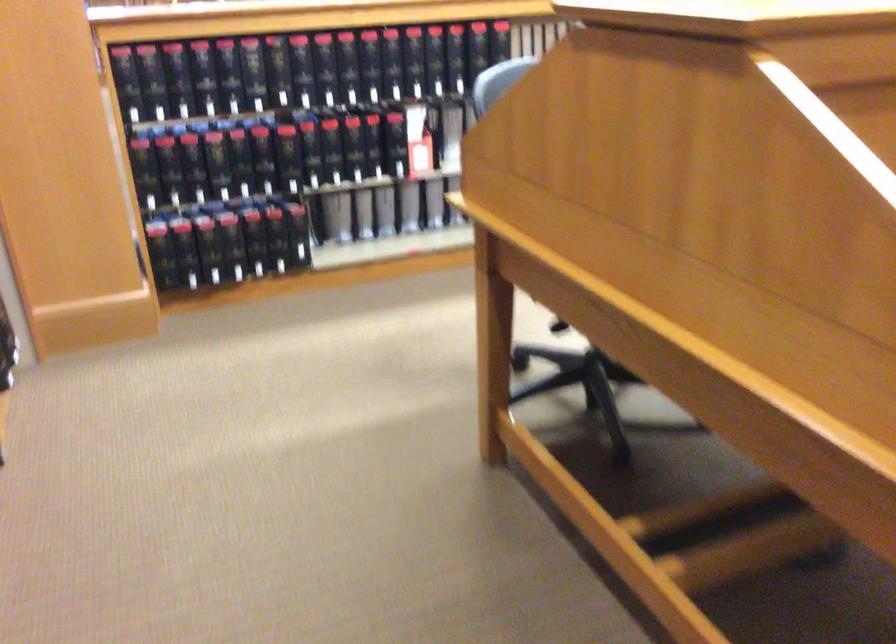
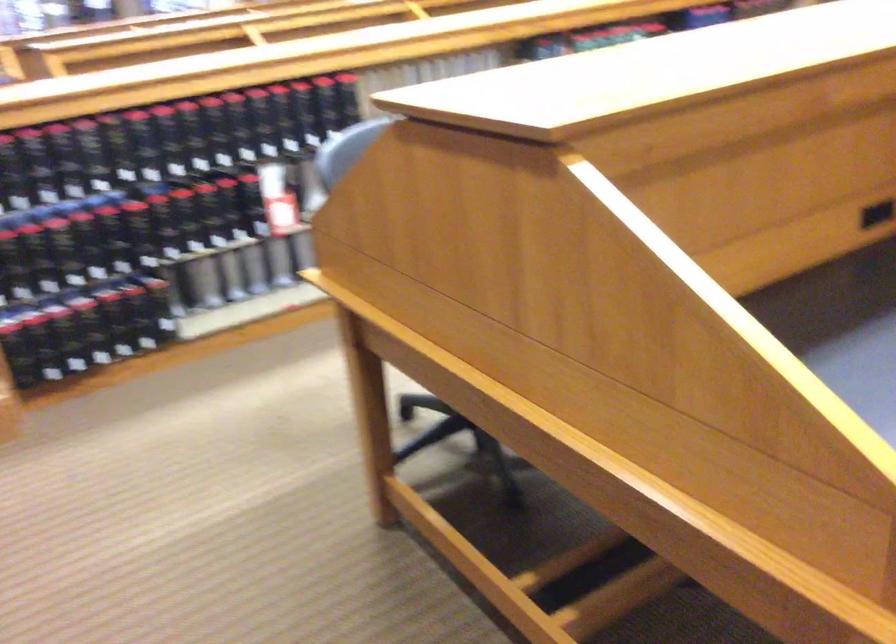
Locate, in the second image, the point that corresponds to (324,75) in the first image.

(165, 142)